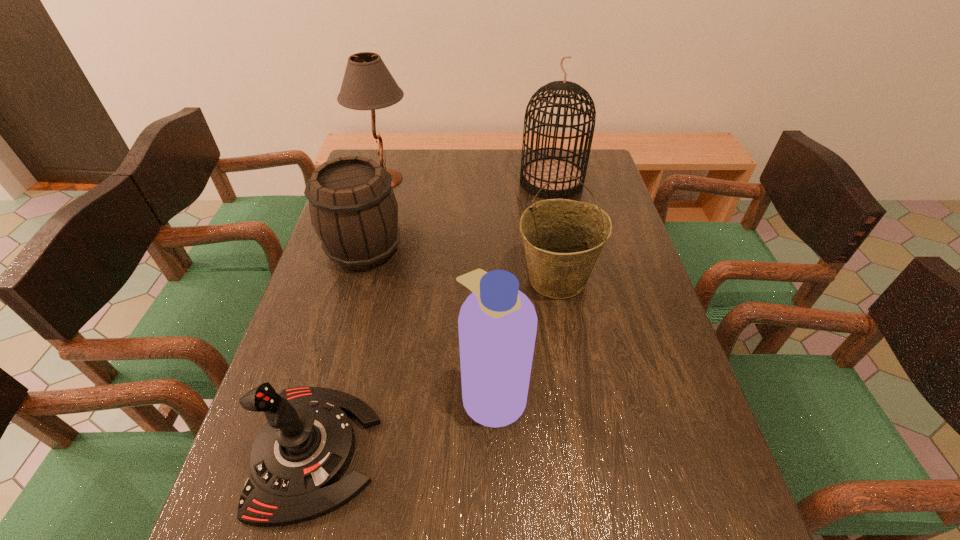
The image size is (960, 540). Find the location of `object located at the far right corner`. object located at the far right corner is located at coordinates (536, 173).

At what (x,y) coordinates should I click in order to perform the action: click on blank space at the far edge of the desktop. Please return your answer as a coordinate pair (x, y). The width and height of the screenshot is (960, 540). Looking at the image, I should click on (455, 177).

At what (x,y) coordinates should I click in order to perform the action: click on free space at the left edge. Please return your answer as a coordinate pair (x, y). Looking at the image, I should click on (305, 314).

The height and width of the screenshot is (540, 960). In order to click on vacant space at the right edge of the desktop in this screenshot , I will do `click(604, 330)`.

Identify the location of vacant space at the far left corner. This screenshot has height=540, width=960. (394, 154).

The width and height of the screenshot is (960, 540). In order to click on vacant area at the far right corner in this screenshot , I will do `click(590, 151)`.

Image resolution: width=960 pixels, height=540 pixels. Find the location of `free space that is in between the joystick and the shampoo`. free space that is in between the joystick and the shampoo is located at coordinates (404, 422).

Image resolution: width=960 pixels, height=540 pixels. What are the coordinates of `empty space between the birdcage and the table lamp` in the screenshot? It's located at (468, 180).

Where is `vacant space in between the table lamp and the birdcage`? Image resolution: width=960 pixels, height=540 pixels. vacant space in between the table lamp and the birdcage is located at coordinates (468, 180).

At what (x,y) coordinates should I click in order to perform the action: click on free area in between the birdcage and the joystick. Please return your answer as a coordinate pair (x, y). The image size is (960, 540). Looking at the image, I should click on (433, 316).